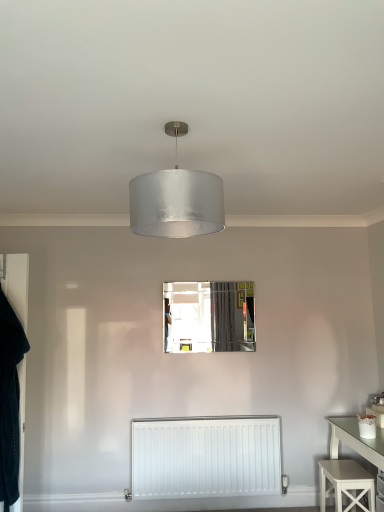
Question: Is clear glass mirror at center facing away from velvet black robe at left?

Choices:
 (A) yes
 (B) no

Answer: (B)

Question: From a real-world perspective, is clear glass mirror at center beneath velvet black robe at left?

Choices:
 (A) yes
 (B) no

Answer: (B)

Question: From the image's perspective, would you say clear glass mirror at center is positioned over velvet black robe at left?

Choices:
 (A) yes
 (B) no

Answer: (A)

Question: Does clear glass mirror at center appear on the right side of velvet black robe at left?

Choices:
 (A) no
 (B) yes

Answer: (B)

Question: Is velvet black robe at left completely or partially inside clear glass mirror at center?

Choices:
 (A) yes
 (B) no

Answer: (B)

Question: Can you confirm if clear glass mirror at center is taller than velvet black robe at left?

Choices:
 (A) no
 (B) yes

Answer: (A)

Question: From the image's perspective, does clear glass mirror at center appear lower than satin silver shade at center?

Choices:
 (A) no
 (B) yes

Answer: (B)

Question: Does clear glass mirror at center lie in front of satin silver shade at center?

Choices:
 (A) yes
 (B) no

Answer: (B)

Question: From a real-world perspective, is clear glass mirror at center located beneath satin silver shade at center?

Choices:
 (A) yes
 (B) no

Answer: (A)

Question: Is clear glass mirror at center wider than satin silver shade at center?

Choices:
 (A) yes
 (B) no

Answer: (B)

Question: From the image's perspective, would you say clear glass mirror at center is positioned over satin silver shade at center?

Choices:
 (A) no
 (B) yes

Answer: (A)

Question: Considering the relative sizes of clear glass mirror at center and satin silver shade at center in the image provided, is clear glass mirror at center taller than satin silver shade at center?

Choices:
 (A) no
 (B) yes

Answer: (B)

Question: Is white painted wood stool at lower right wider than clear glass mirror at center?

Choices:
 (A) no
 (B) yes

Answer: (B)